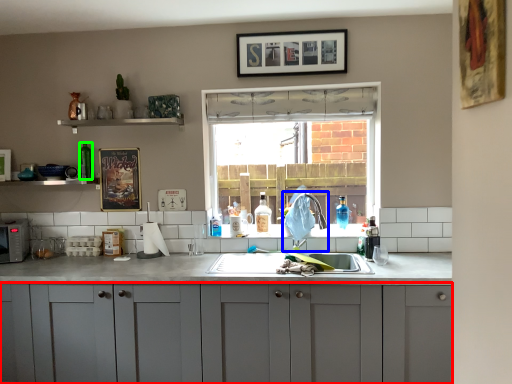
Question: Based on their relative distances, which object is nearer to cabinetry (highlighted by a red box)? Choose from faucet (highlighted by a blue box) and bottle (highlighted by a green box).

Choices:
 (A) faucet
 (B) bottle

Answer: (A)